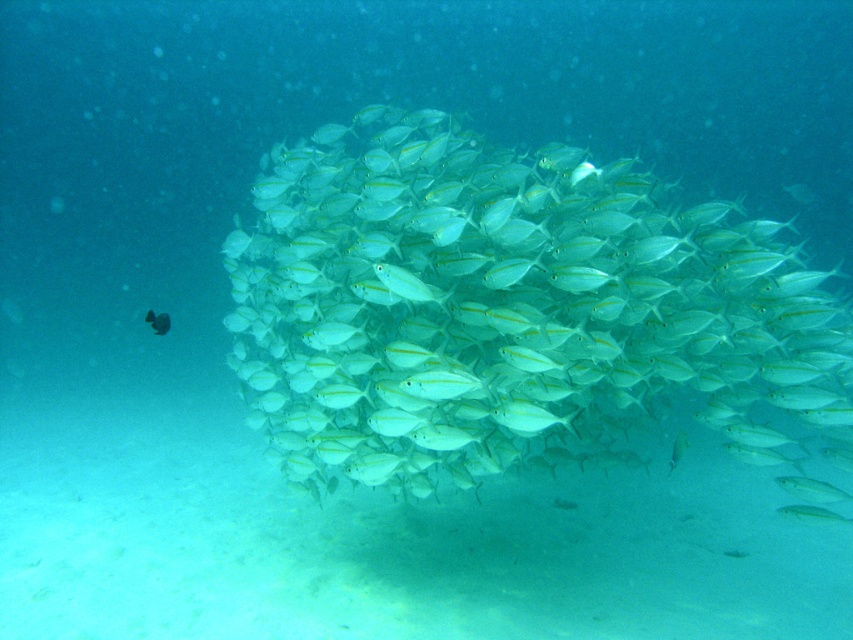
Question: Does translucent white fish at center have a lesser width compared to shiny silver fish at center?

Choices:
 (A) no
 (B) yes

Answer: (A)

Question: Which object is farther from the camera taking this photo?

Choices:
 (A) shiny silver fish at center
 (B) translucent white fish at center

Answer: (A)

Question: Can you confirm if translucent white fish at center is positioned to the right of shiny silver fish at center?

Choices:
 (A) yes
 (B) no

Answer: (A)

Question: Is translucent white fish at center above shiny silver fish at center?

Choices:
 (A) yes
 (B) no

Answer: (B)